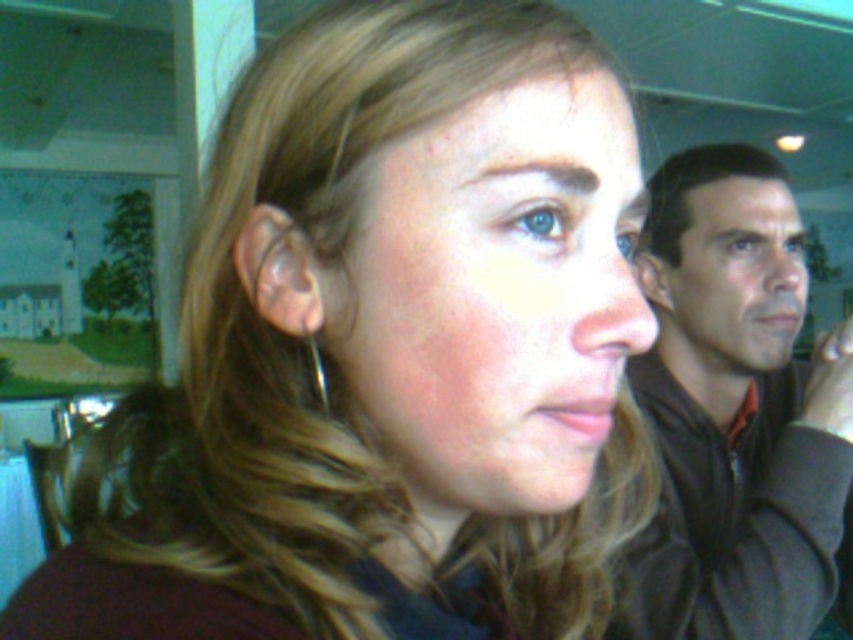
What do you see at coordinates (695, 188) in the screenshot?
I see `dark brown hair at upper right` at bounding box center [695, 188].

Between dark brown hair at upper right and silver metallic earring at ear, which one has less height?

Standing shorter between the two is silver metallic earring at ear.

Which is behind, point (701, 156) or point (318, 356)?

The point (701, 156) is behind.

In order to click on dark brown hair at upper right in this screenshot , I will do `click(695, 188)`.

The height and width of the screenshot is (640, 853). What are the coordinates of `brown fabric jacket at right` in the screenshot? It's located at (734, 412).

Does brown fabric jacket at right have a lesser width compared to dark brown hair at upper right?

In fact, brown fabric jacket at right might be wider than dark brown hair at upper right.

Between point (701, 467) and point (664, 236), which one is positioned in front?

Point (701, 467)

The height and width of the screenshot is (640, 853). I want to click on brown fabric jacket at right, so click(734, 412).

Is brown fabric jacket at right to the left of silver metallic earring at ear from the viewer's perspective?

No, brown fabric jacket at right is not to the left of silver metallic earring at ear.

Locate an element on the screen. brown fabric jacket at right is located at coordinates (734, 412).